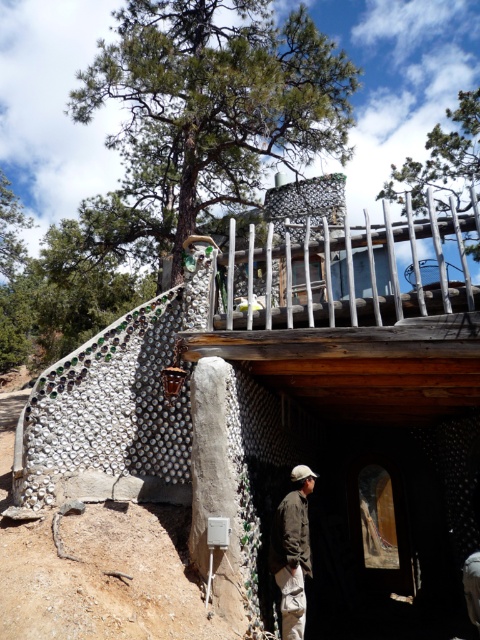
You are a visitor standing at the base of the hillside structure. You want to take a photo of the bottle mosaic hut at upper center. Which direction should you face to ensure it is centered in your camera view?

The bottle mosaic hut at upper center is located at point [358,394], which means it is positioned towards the upper center of the scene. To center it in your camera view, you should face upwards and towards the center of the structure.

You are standing at the entrance of the bottle mosaic hut at upper center and want to greet the person wearing the brown fabric jacket at lower center. In which direction should you move to approach them?

You should move to the left because the bottle mosaic hut at upper center is to the right of the brown fabric jacket at lower center, so moving left will bring you closer to the jacket wearer.

You are standing in front of the bottle mosaic structure and want to take a photo. There are two points marked on the structure at coordinates point (276,264) and point (300,547). Which point will appear closer to the camera in your photo?

Point (276,264) is further to the camera than point (300,547), so it will appear closer in the photo.